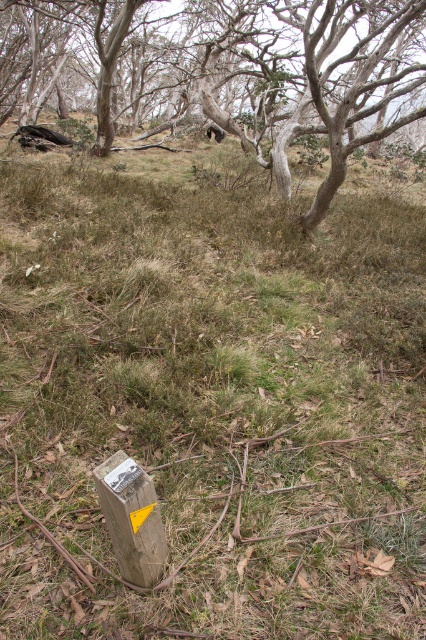
Question: Can you confirm if smooth bark tree at center is positioned below metallic silver sign at lower center?

Choices:
 (A) no
 (B) yes

Answer: (A)

Question: Can you confirm if smooth bark tree at center is positioned to the right of metallic silver sign at lower center?

Choices:
 (A) yes
 (B) no

Answer: (A)

Question: Where is smooth bark tree at center located in relation to wooden post at lower center in the image?

Choices:
 (A) left
 (B) right

Answer: (B)

Question: Which point appears farthest from the camera in this image?

Choices:
 (A) (173, 51)
 (B) (146, 584)

Answer: (A)

Question: Which of these objects is positioned closest to the wooden post at lower center?

Choices:
 (A) smooth bark tree at center
 (B) metallic silver sign at lower center

Answer: (B)

Question: Estimate the real-world distances between objects in this image. Which object is closer to the smooth bark tree at center?

Choices:
 (A) wooden post at lower center
 (B) metallic silver sign at lower center

Answer: (A)